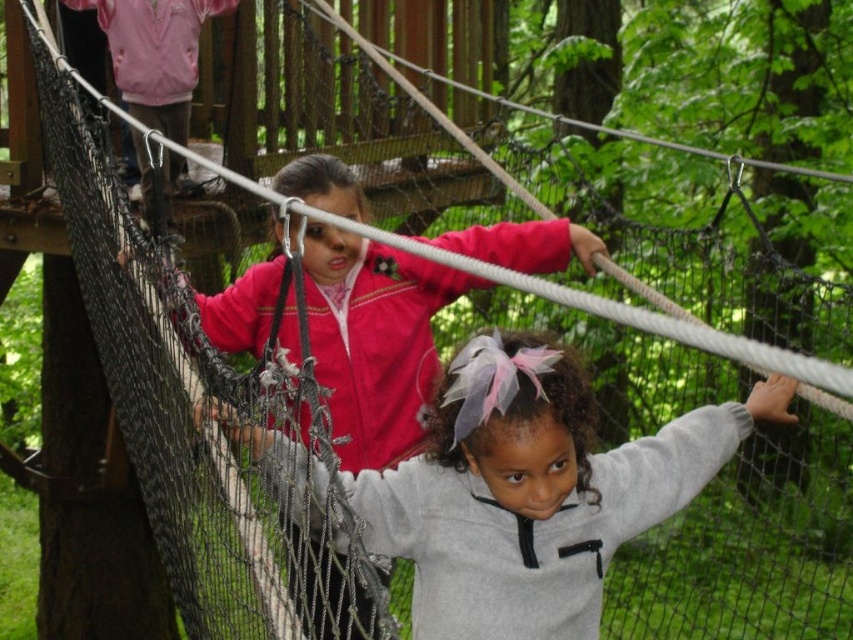
Question: Observing the image, what is the correct spatial positioning of gray fleece jacket at center in reference to pink fleece jacket at upper center?

Choices:
 (A) right
 (B) left

Answer: (A)

Question: Which point is closer to the camera?

Choices:
 (A) (442, 588)
 (B) (340, 296)

Answer: (A)

Question: Which point is farther from the camera taking this photo?

Choices:
 (A) (397, 316)
 (B) (550, 620)

Answer: (A)

Question: Where is gray fleece jacket at center located in relation to pink fleece jacket at upper center in the image?

Choices:
 (A) above
 (B) below

Answer: (B)

Question: Can you confirm if gray fleece jacket at center is thinner than pink fleece jacket at upper center?

Choices:
 (A) yes
 (B) no

Answer: (A)

Question: Which object appears closest to the camera in this image?

Choices:
 (A) pink fleece jacket at upper center
 (B) gray fleece jacket at center

Answer: (A)